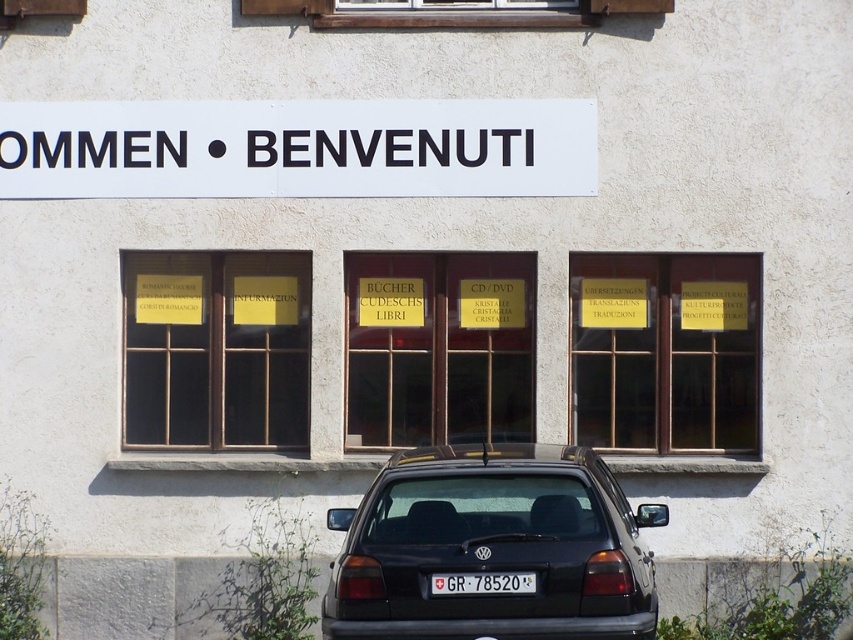
You are a delivery person trying to park your black matte sedan at center in a parking spot that can only accommodate vehicles narrower than the white plastic sign at upper center. Can your sedan fit in the spot?

The black matte sedan at center has a width less than the white plastic sign at upper center, so it can fit in the parking spot.

You are driving a car and see the building with the white plastic sign at upper center and the white plastic license plate at center. Which object is closer to you?

The white plastic license plate at center is behind the white plastic sign at upper center, so the white plastic sign at upper center is closer to you.

You are a delivery driver who needs to park your truck next to the building. The truck is 2 meters tall. Can the black matte sedan at center and the white plastic license plate at center fit under the building signboard?

The black matte sedan at center is taller than the white plastic license plate at center. Since the truck is 2 meters tall, the sedan may not fit under the signboard if it exceeds that height, but the exact dimensions aren